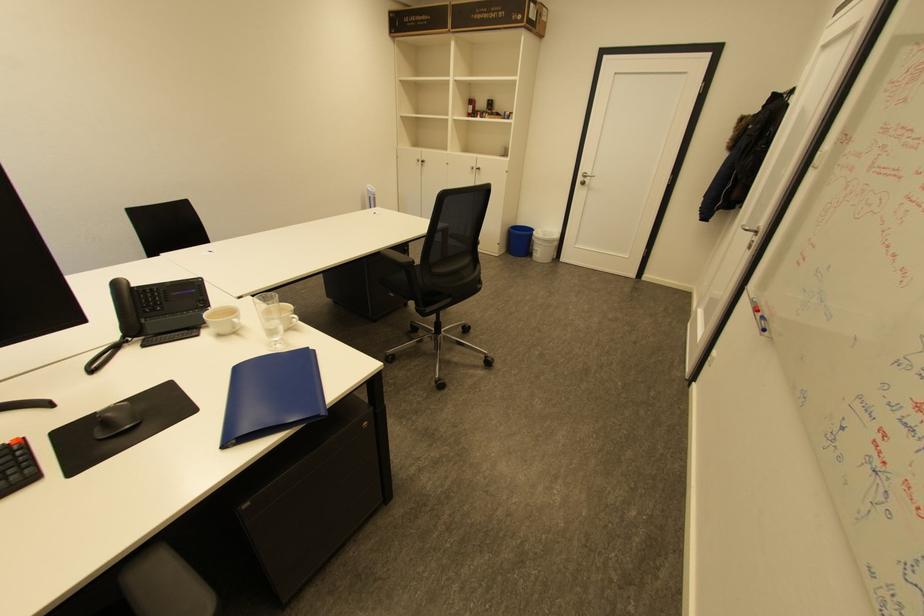
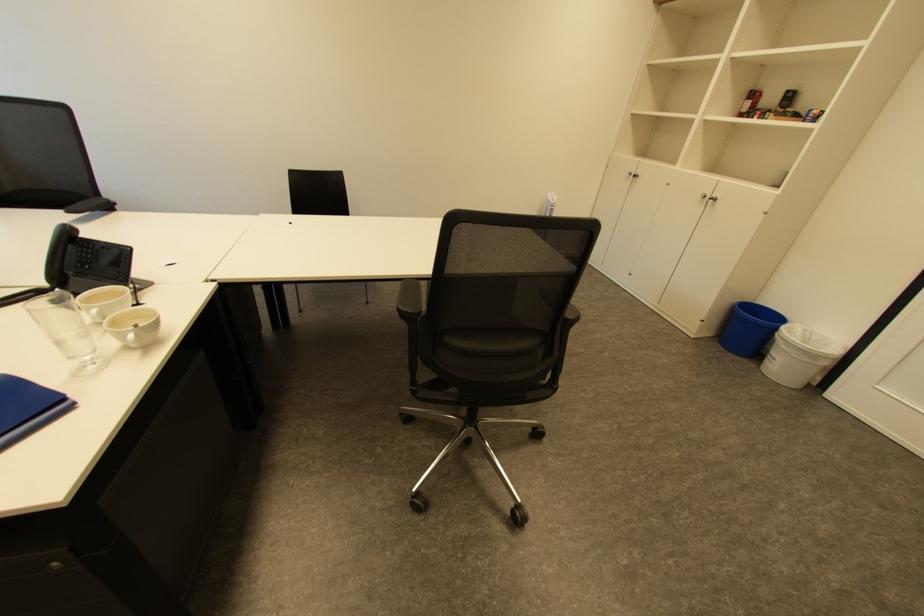
Find the pixel in the second image that matches [517,254] in the first image.

(728, 346)